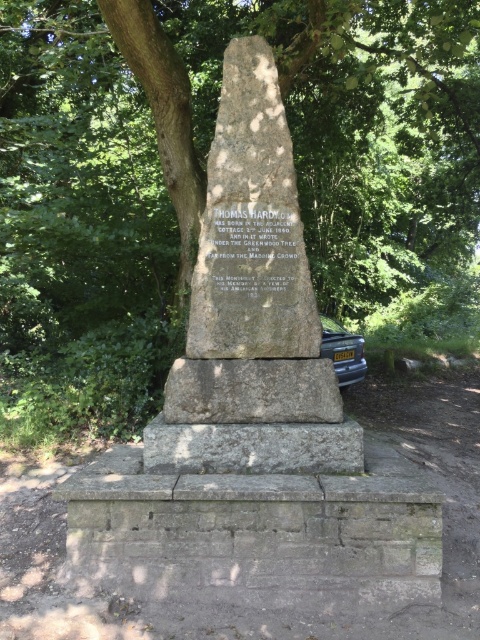
You are a visitor at the monument and want to take a photo of both the gray stone monument at center and the metallic gray car at lower right in the same frame. Based on their positions, which direction should you move to ensure both are visible?

Since the gray stone monument at center is to the left of the metallic gray car at lower right, you should move to the left to include both the gray stone monument at center and the metallic gray car at lower right in the same frame.

You are a photographer wanting to capture the monument without any obstructions. You notice the green leafy tree at center and the metallic gray car at lower right in your current view. Which object should you move to ensure the monument is fully visible?

The green leafy tree at center is positioned over metallic gray car at lower right. To ensure the monument is fully visible, you should move the green leafy tree at center out of the frame since it is covering part of the monument.

You are a visitor standing in front of the monument. You notice the green leafy tree at center and the stone plaque at center. Which object is higher up in the scene?

The green leafy tree at center is above the stone plaque at center, so the green leafy tree at center is higher up in the scene.